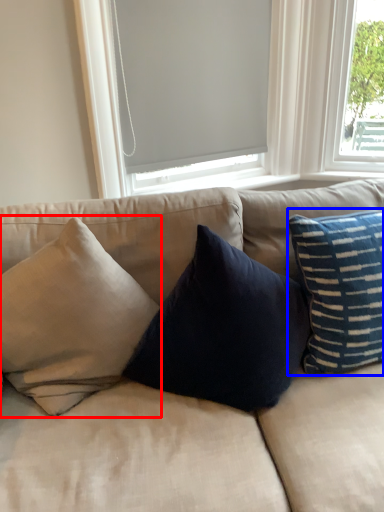
Question: Among these objects, which one is farthest to the camera, pillow (highlighted by a red box) or pillow (highlighted by a blue box)?

Choices:
 (A) pillow
 (B) pillow

Answer: (B)